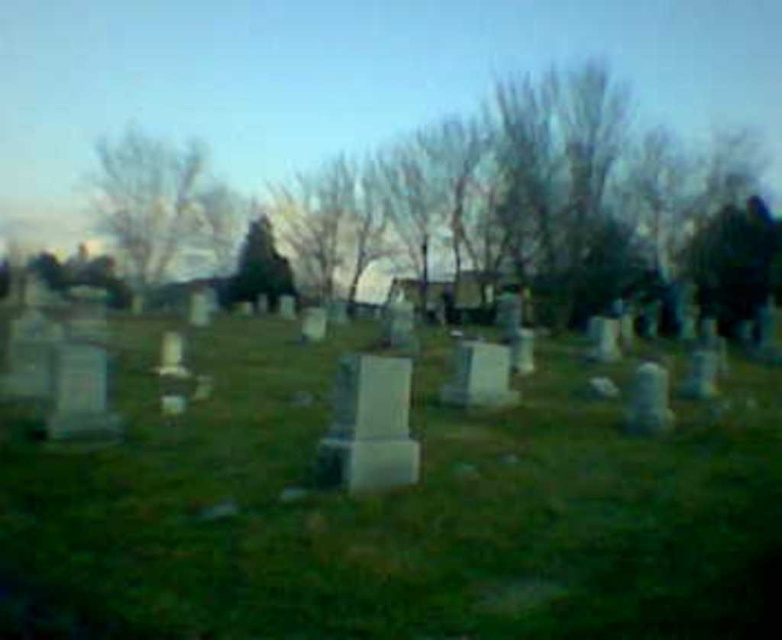
Question: Which object appears closest to the camera in this image?

Choices:
 (A) green grassy at center
 (B) smooth gray stone at lower right

Answer: (A)

Question: Observing the image, what is the correct spatial positioning of white marble gravestone at center in reference to smooth gray stone at lower right?

Choices:
 (A) right
 (B) left

Answer: (B)

Question: Estimate the real-world distances between objects in this image. Which object is closer to the green grassy at center?

Choices:
 (A) white stone gravestone at center
 (B) smooth gray stone at lower right
 (C) white marble gravestone at center

Answer: (C)

Question: Considering the relative positions of white stone gravestone at center and smooth gray gravestone at center-right in the image provided, where is white stone gravestone at center located with respect to smooth gray gravestone at center-right?

Choices:
 (A) right
 (B) left

Answer: (B)

Question: Does green grassy at center appear on the left side of smooth gray stone at lower right?

Choices:
 (A) yes
 (B) no

Answer: (A)

Question: Which is nearer to the smooth gray stone at lower right?

Choices:
 (A) smooth gray gravestone at center-right
 (B) white stone gravestone at center
 (C) white marble gravestone at center

Answer: (B)